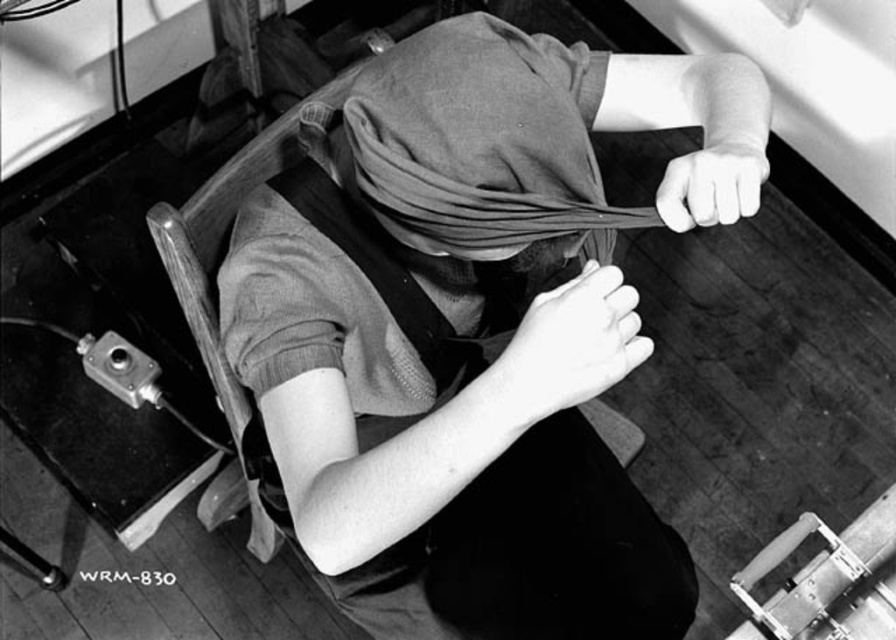
You are a researcher observing the subject in the restraint chair. You notice the matte fabric head covering at center and the smooth skin hand at center. Which object is bigger in size?

The matte fabric head covering at center is larger in size than the smooth skin hand at center.

Based on the scene described, can you determine if the smooth skin hand at center is visible from the front of the matte fabric head covering at center?

The smooth skin hand at center is behind the matte fabric head covering at center, so it is not visible from the front of the matte fabric head covering at center.

Consider the image. You are a medical assistant observing the scene. You need to determine the relative size of the smooth skin hand at center and the black leather strap at center. Which object is taller?

Result: The smooth skin hand at center is not as tall as the black leather strap at center, so the black leather strap at center is taller.